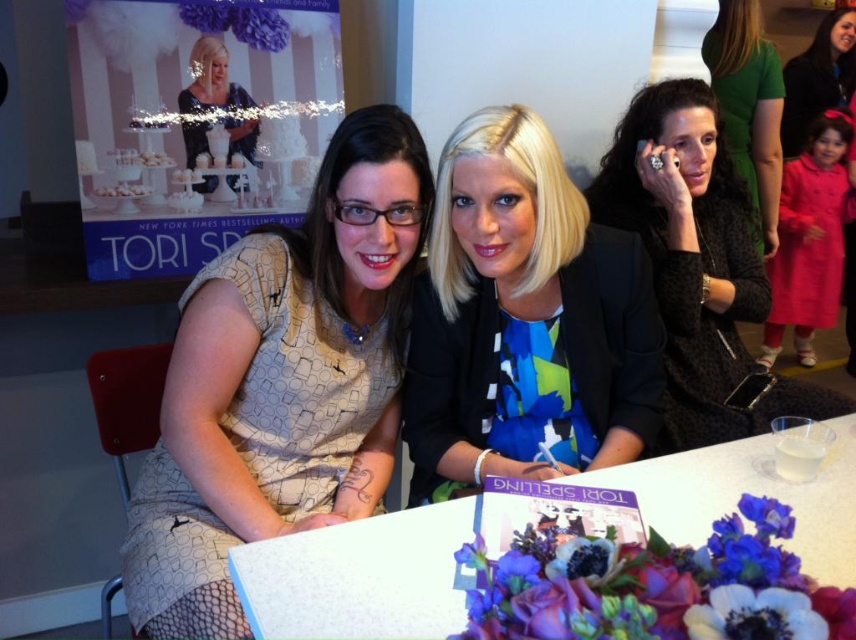
You are a photographer at a fashion show. You need to position the velvety pink coat at right and the shiny blue dress at center in a way that the coat is to the right of the dress. Is this arrangement already correct based on the scene?

Yes, the velvety pink coat at right is already positioned to the right of the shiny blue dress at center as described.

From the picture: You are a photographer standing 2 meters away from the two women at the book signing event. You want to take a photo that includes both women and the black textured jacket at upper right in the frame. Can you do this without moving your position?

The two women are 1.46 meters apart, so from your position 2 meters away, it is possible to capture both women and the black textured jacket at upper right in the same frame without moving.